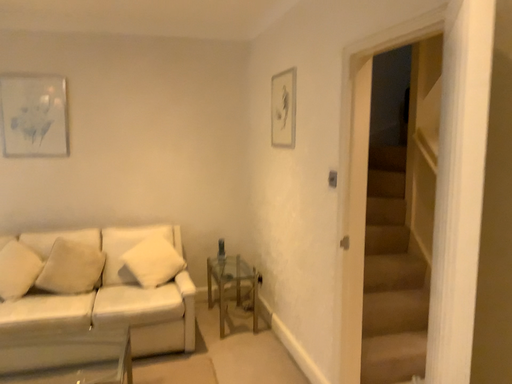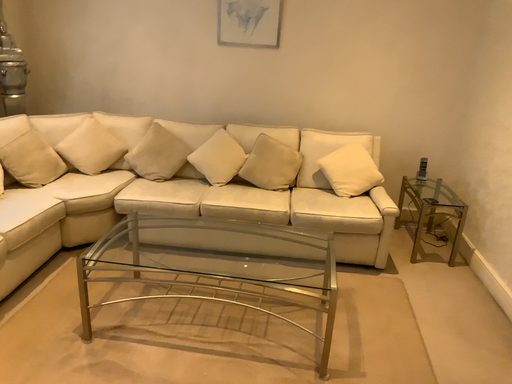
Question: How did the camera likely rotate when shooting the video?

Choices:
 (A) rotated upward
 (B) rotated downward

Answer: (B)